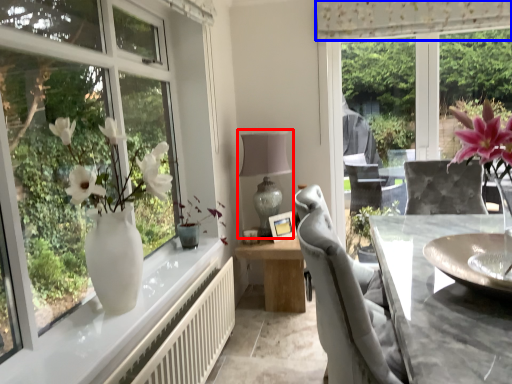
Question: Which point is closer to the camera, table lamp (highlighted by a red box) or curtain (highlighted by a blue box)?

Choices:
 (A) table lamp
 (B) curtain

Answer: (B)